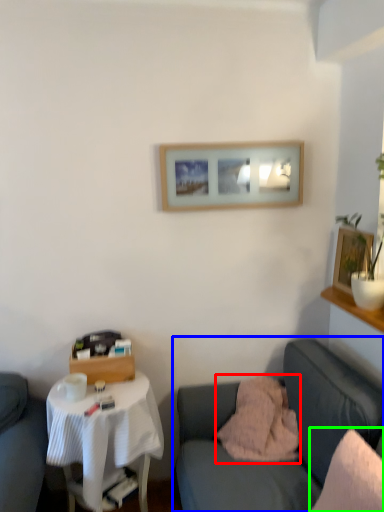
Question: Which is farther away from pillow (highlighted by a red box)? studio couch (highlighted by a blue box) or pillow (highlighted by a green box)?

Choices:
 (A) studio couch
 (B) pillow

Answer: (B)